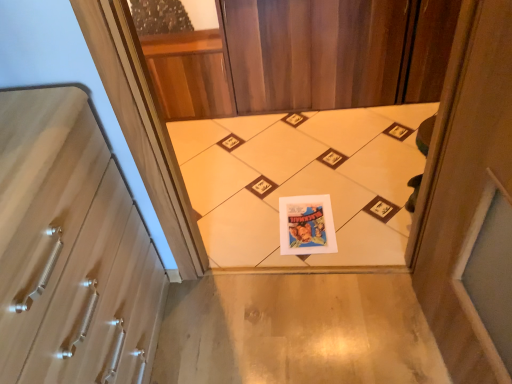
Where is `wooden at left`? The width and height of the screenshot is (512, 384). wooden at left is located at coordinates (102, 298).

This screenshot has width=512, height=384. What do you see at coordinates (102, 298) in the screenshot? I see `wooden at left` at bounding box center [102, 298].

Identify the location of white paper print at center. The image size is (512, 384). (300, 182).

What do you see at coordinates (300, 182) in the screenshot? I see `white paper print at center` at bounding box center [300, 182].

Where is `wooden at left`? This screenshot has height=384, width=512. wooden at left is located at coordinates (102, 298).

Considering the relative positions of white paper print at center and wooden at left in the image provided, is white paper print at center to the left or to the right of wooden at left?

From the image, it's evident that white paper print at center is to the right of wooden at left.

Between white paper print at center and wooden at left, which one is positioned in front?

wooden at left is in front.

Which is behind, point (357, 227) or point (114, 194)?

The point (357, 227) is behind.

From the image's perspective, which one is positioned higher, white paper print at center or wooden at left?

white paper print at center.

From a real-world perspective, who is located lower, white paper print at center or wooden at left?

white paper print at center.

Is white paper print at center thinner than wooden at left?

No, white paper print at center is not thinner than wooden at left.

Who is shorter, white paper print at center or wooden at left?

white paper print at center is shorter.

Considering the relative sizes of white paper print at center and wooden at left in the image provided, is white paper print at center smaller than wooden at left?

Indeed, white paper print at center has a smaller size compared to wooden at left.

Can we say white paper print at center lies outside wooden at left?

white paper print at center is positioned outside wooden at left.

Can you see white paper print at center touching wooden at left?

No, white paper print at center is not beside wooden at left.

Is white paper print at center facing towards wooden at left?

No.

What are the coordinates of `drawer above the white paper print at center (from a real-world perspective)` in the screenshot? It's located at (102, 298).

Would you say wooden at left is to the left or to the right of white paper print at center in the picture?

From the image, it's evident that wooden at left is to the left of white paper print at center.

In the image, is wooden at left positioned in front of or behind white paper print at center?

In the image, wooden at left appears in front of white paper print at center.

Is point (141, 347) behind point (352, 232)?

No, it is in front of (352, 232).

From the image's perspective, does wooden at left appear lower than white paper print at center?

Yes, from the image's perspective, wooden at left is beneath white paper print at center.

From a real-world perspective, is wooden at left beneath white paper print at center?

No, from a real-world perspective, wooden at left is not below white paper print at center.

Which of these two, wooden at left or white paper print at center, is thinner?

wooden at left.

Is wooden at left shorter than white paper print at center?

In fact, wooden at left may be taller than white paper print at center.

Who is bigger, wooden at left or white paper print at center?

Bigger between the two is wooden at left.

Is white paper print at center completely or partially inside wooden at left?

No, white paper print at center is not surrounded by wooden at left.

Is wooden at left not close to white paper print at center?

That's not correct — wooden at left is a little close to white paper print at center.

Could you tell me if wooden at left is facing white paper print at center?

No, wooden at left is not facing towards white paper print at center.

How many degrees apart are the facing directions of wooden at left and white paper print at center?

The angle between the facing direction of wooden at left and the facing direction of white paper print at center is 90.1 degrees.

Where is `print above the wooden at left (from the image's perspective)`? This screenshot has width=512, height=384. print above the wooden at left (from the image's perspective) is located at coordinates (300, 182).

Where is `drawer lying below the white paper print at center (from the image's perspective)`? The image size is (512, 384). drawer lying below the white paper print at center (from the image's perspective) is located at coordinates (102, 298).

I want to click on print that is on the right side of wooden at left, so click(300, 182).